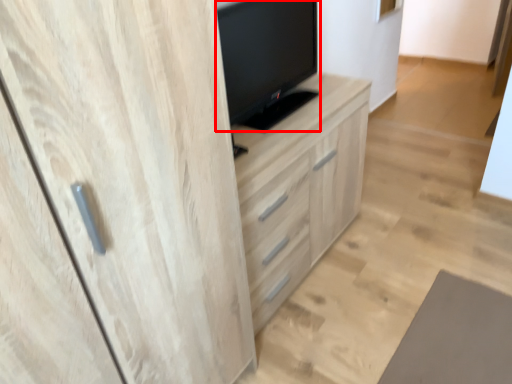
Question: From the image's perspective, where is television (annotated by the red box) located in relation to chest of drawers in the image?

Choices:
 (A) below
 (B) above

Answer: (B)